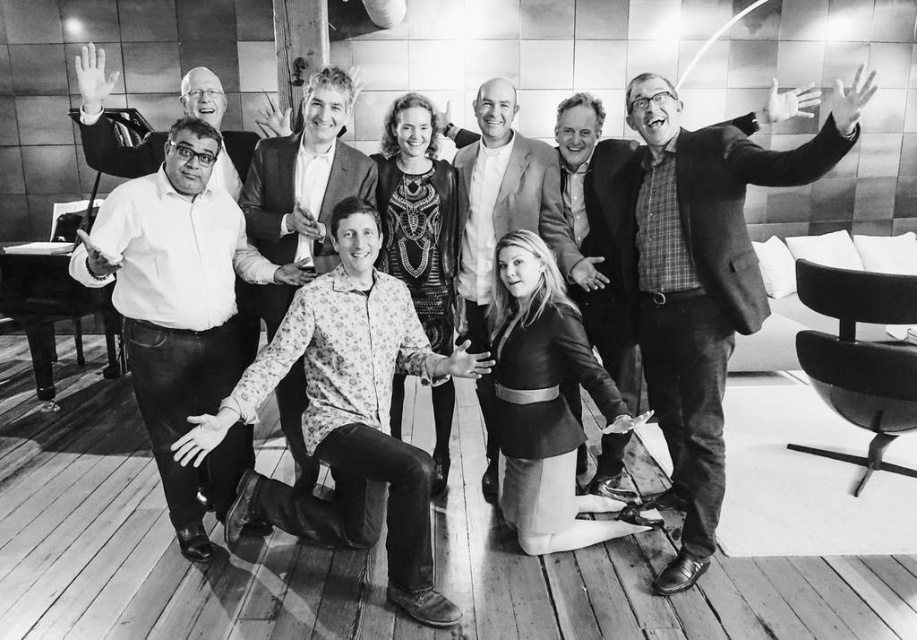
Question: Which of the following is the farthest from the observer?

Choices:
 (A) floral shirt at center
 (B) matte white shirt at left
 (C) floral-patterned shirt at center
 (D) smooth leather jacket at center

Answer: (D)

Question: Among these points, which one is farthest from the camera?

Choices:
 (A) (83, 150)
 (B) (492, 84)
 (C) (571, 212)
 (D) (191, 444)

Answer: (A)

Question: Based on their relative distances, which object is nearer to the floral shirt at center?

Choices:
 (A) smooth white shirt at left
 (B) plaid fabric shirt at right
 (C) smooth leather jacket at center

Answer: (A)

Question: Does floral shirt at center have a lesser width compared to leather jacket at center?

Choices:
 (A) no
 (B) yes

Answer: (A)

Question: In this image, where is plaid fabric shirt at right located relative to leather jacket at center?

Choices:
 (A) left
 (B) right

Answer: (B)

Question: Can you confirm if smooth white shirt at left is positioned to the left of leather jacket at center?

Choices:
 (A) yes
 (B) no

Answer: (A)